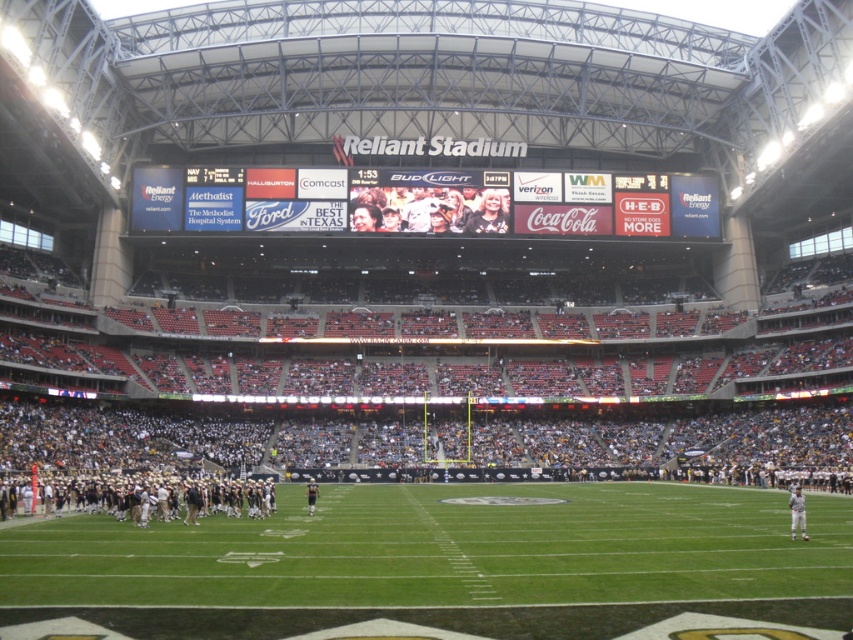
You are a photographer at Reliant Stadium during a Houston Texans game. You want to capture a photo that includes both the white digital scoreboard at center and the dark gray uniformed players at lower left. Given their sizes in the image, which object should you focus on first to ensure both are in frame?

The white digital scoreboard at center is bigger than the dark gray uniformed players at lower left, so you should focus on the white digital scoreboard at center first to ensure both are in frame.

You are standing at the entrance of Reliant Stadium and want to see the white digital scoreboard at center clearly. Given that the optimal viewing distance for such a scoreboard is between 200 to 300 feet, can you determine if your current position allows for an optimal viewing experience?

The white digital scoreboard at center is 407.97 feet away from the camera, which exceeds the optimal viewing distance range of 200 to 300 feet. Therefore, the current position does not provide an optimal viewing experience.